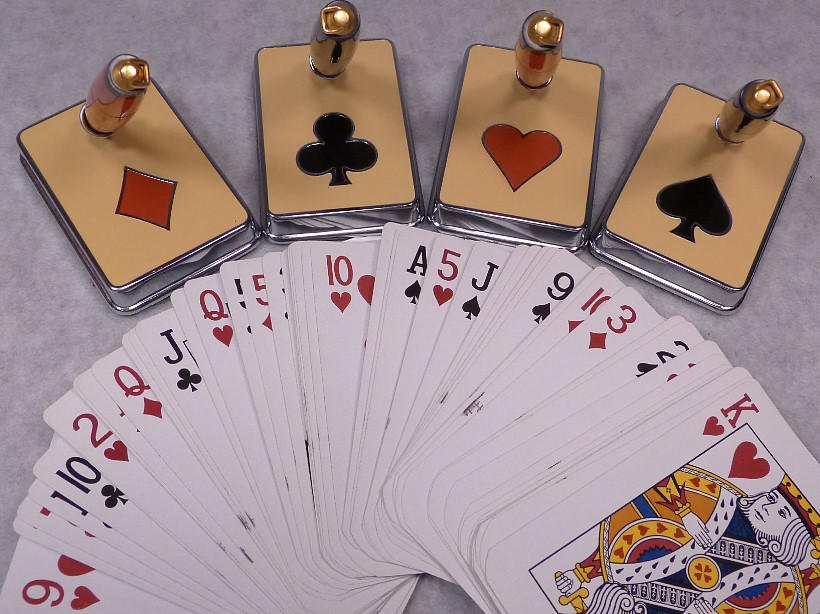
You are a GUI agent. You are given a task and a screenshot of the screen. Output one action in this format:
    pyautogui.click(x=<x>, y=<y>)
    Task: Click on the fanned out deck of playing cards in an arc shape
    The height and width of the screenshot is (614, 820).
    Given the screenshot: What is the action you would take?
    pyautogui.click(x=80, y=589), pyautogui.click(x=107, y=527), pyautogui.click(x=167, y=457), pyautogui.click(x=238, y=403), pyautogui.click(x=325, y=371), pyautogui.click(x=402, y=366), pyautogui.click(x=515, y=395), pyautogui.click(x=570, y=443), pyautogui.click(x=603, y=532)